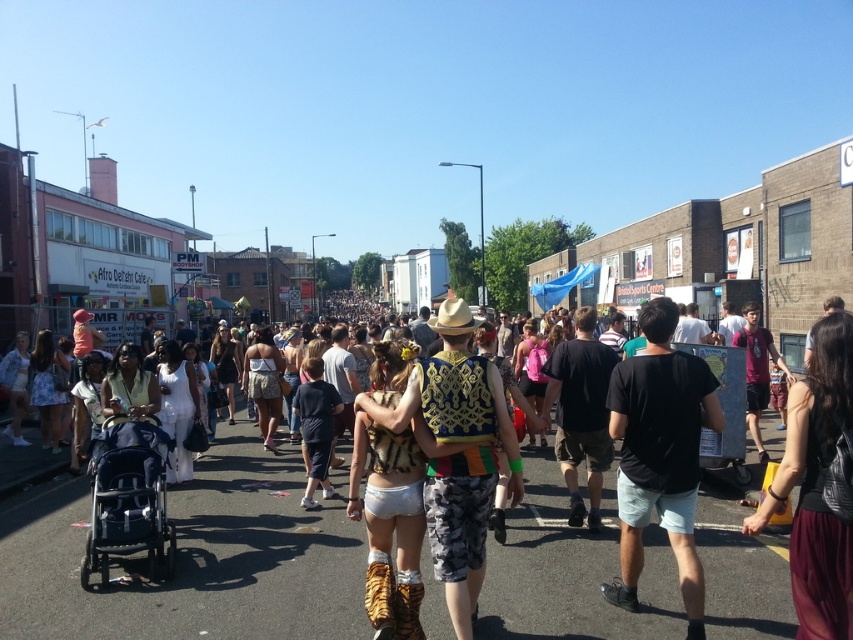
You are a photographer trying to capture a clear shot of the beige straw cowboy hat at center without the dark gray fabric baby carriage at lower left blocking the view. Based on their positions, can you position yourself in a way to avoid the baby carriage obstructing the hat?

The dark gray fabric baby carriage at lower left is below the beige straw cowboy hat at center, so if you position yourself slightly above the baby carriage, you can capture the hat without obstruction.